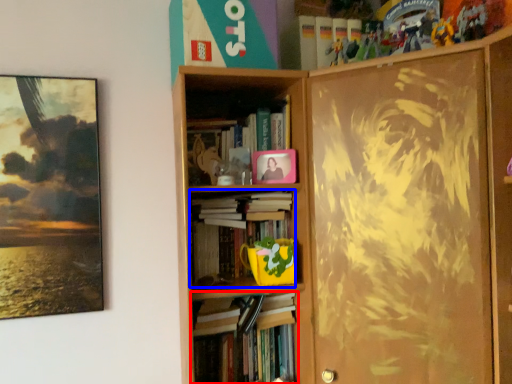
Question: Which point is further to the camera, book (highlighted by a red box) or book (highlighted by a blue box)?

Choices:
 (A) book
 (B) book

Answer: (B)